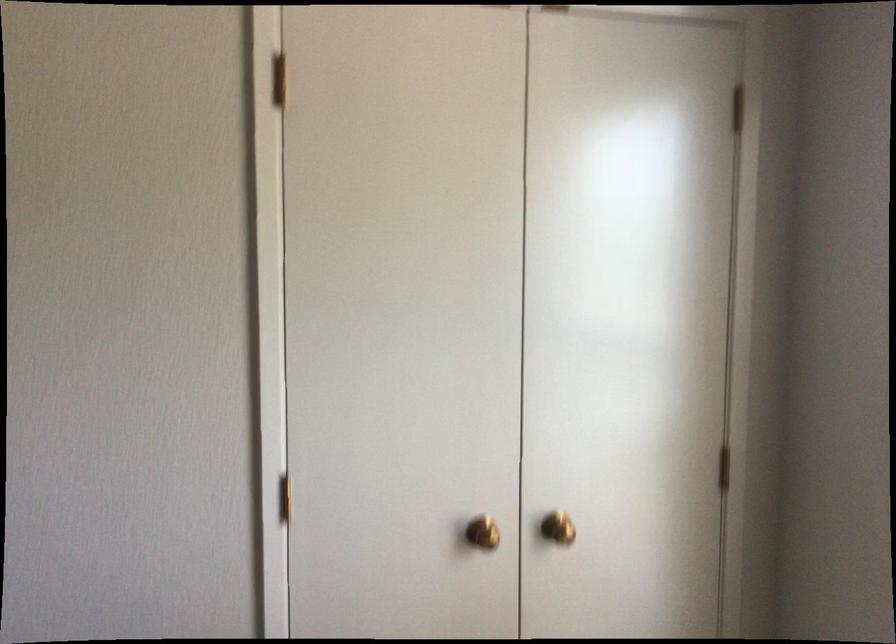
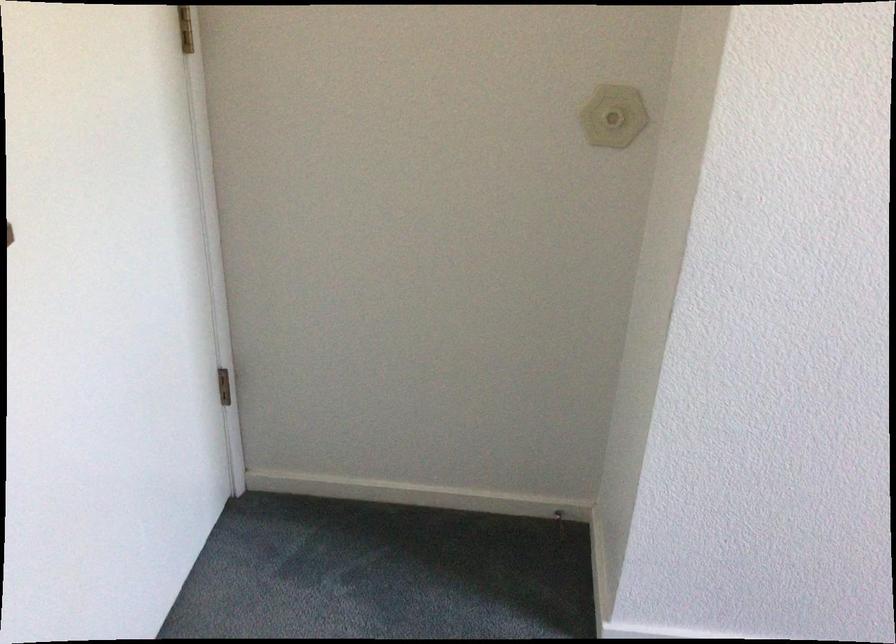
Question: The images are taken continuously from a first-person perspective. In which direction are you moving?

Choices:
 (A) Left
 (B) Right
 (C) Forward
 (D) Backward

Answer: (A)